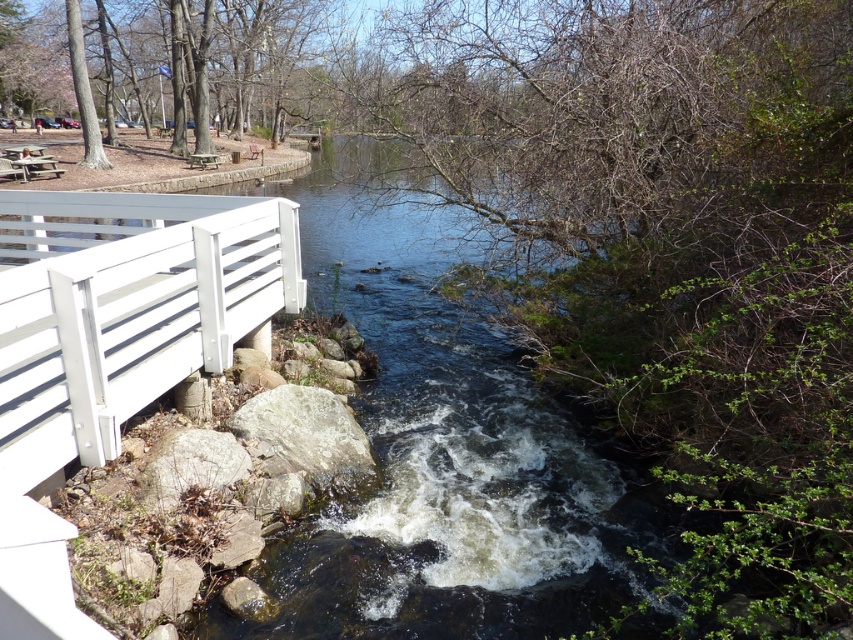
You are standing at the point marked as point (305, 428) in the image. What object is located exactly at that point?

The gray rough rock at lower center is located exactly at point (305, 428).

You are standing on the white wooden bridge with horizontal slats on the left side of the image. You see two gray rough rocks in the stream below you. How far apart are the gray rough rock at lower center and the gray rough rock at lower left?

The gray rough rock at lower center is 33.28 inches from the gray rough rock at lower left.

You are a painter setting up an easel to paint the scene. You want to focus on the white matte bridge at left and the gray rough rock at lower center. Which object should you place closer to your easel to paint them both clearly?

Since the white matte bridge at left occupies less space than the gray rough rock at lower center, you should place the gray rough rock at lower center closer to your easel to ensure both objects are painted clearly. This way, the larger object won